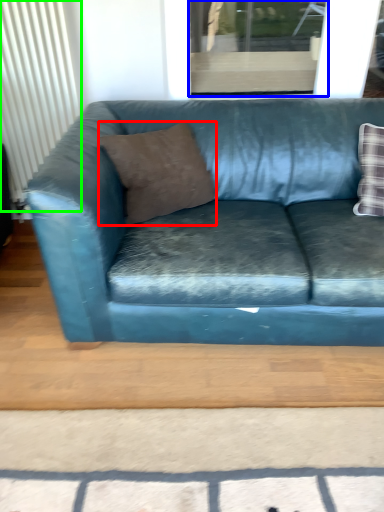
Question: Which object is the farthest from pillow (highlighted by a red box)? Choose among these: window (highlighted by a blue box) or radiator (highlighted by a green box).

Choices:
 (A) window
 (B) radiator

Answer: (A)